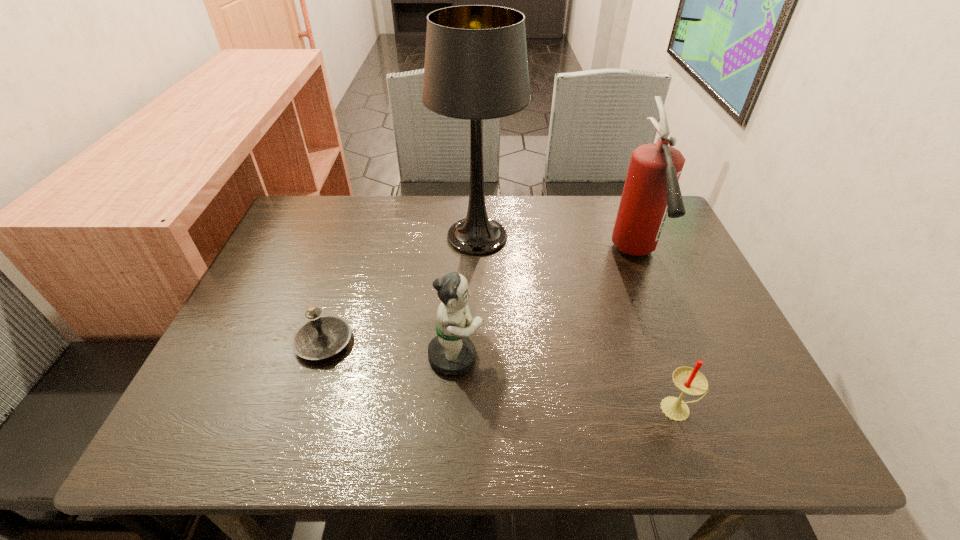
This screenshot has height=540, width=960. Find the location of `vacant region between the nearer candle and the shorter candle`. vacant region between the nearer candle and the shorter candle is located at coordinates (501, 375).

I want to click on empty space that is in between the nearest object and the fire extinguisher, so (657, 332).

Identify which object is the second nearest to the figurine. Please provide its 2D coordinates. Your answer should be formatted as a tuple, i.e. [(x, y)], where the tuple contains the x and y coordinates of a point satisfying the conditions above.

[(476, 68)]

Select which object is the second closest to the fire extinguisher. Please provide its 2D coordinates. Your answer should be formatted as a tuple, i.e. [(x, y)], where the tuple contains the x and y coordinates of a point satisfying the conditions above.

[(690, 381)]

Where is `free spot that satisfies the following two spatial constraints: 1. on the front-facing side of the figurine; 2. on the back side of the taller candle`? This screenshot has width=960, height=540. free spot that satisfies the following two spatial constraints: 1. on the front-facing side of the figurine; 2. on the back side of the taller candle is located at coordinates (453, 409).

Locate an element on the screen. vacant space that satisfies the following two spatial constraints: 1. on the front-facing side of the nearest object; 2. on the right side of the third tallest object is located at coordinates (453, 409).